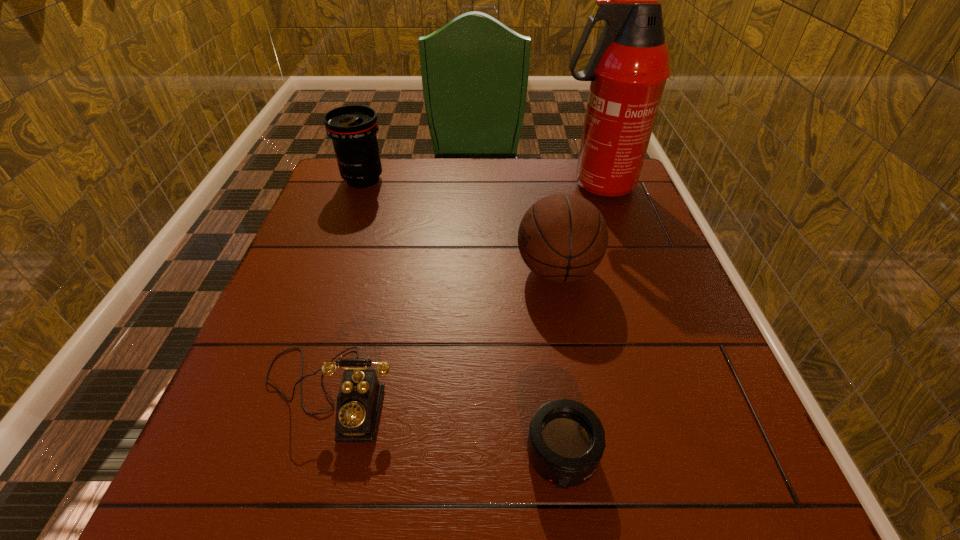
Identify the location of vacant region that satisfies the following two spatial constraints: 1. on the trigger side of the fire extinguisher; 2. on the dial of the second shortest object. (668, 392).

This screenshot has width=960, height=540. In order to click on vacant point that satisfies the following two spatial constraints: 1. on the side with brand label of the basketball; 2. on the dial of the telephone in this screenshot , I will do `click(579, 392)`.

This screenshot has height=540, width=960. Find the location of `free space that satisfies the following two spatial constraints: 1. on the trigger side of the tallest object; 2. on the side of the right telephoto lens with brand markings and control switches`. free space that satisfies the following two spatial constraints: 1. on the trigger side of the tallest object; 2. on the side of the right telephoto lens with brand markings and control switches is located at coordinates (690, 455).

Identify the location of blank space that satisfies the following two spatial constraints: 1. on the side with brand label of the third farthest object; 2. on the dial of the telephone. The image size is (960, 540). [x=579, y=392].